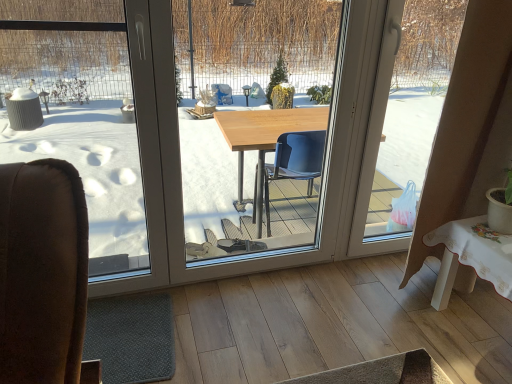
This screenshot has height=384, width=512. Identify the location of free spot below transparent plastic bag at right, which is the first window screen in right-to-left order (from a real-world perspective). (381, 251).